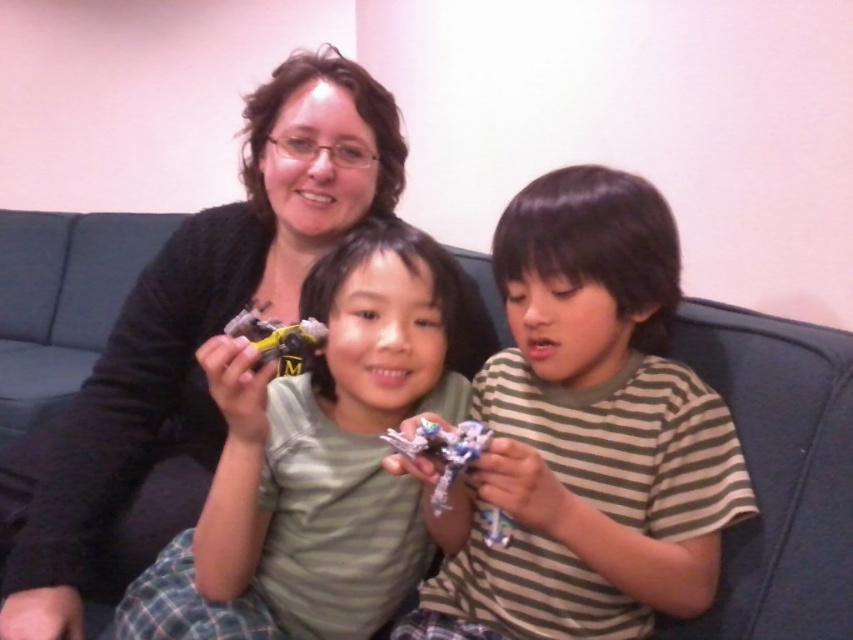
Which is more to the left, metallic silver toy at center or yellow plastic toy at center?

From the viewer's perspective, yellow plastic toy at center appears more on the left side.

Measure the distance between metallic silver toy at center and camera.

metallic silver toy at center is 26.01 inches away from camera.

Locate an element on the screen. This screenshot has width=853, height=640. metallic silver toy at center is located at coordinates tap(587, 433).

Looking at this image, is matte plastic toy car at center positioned in front of yellow plastic toy at center?

Yes, it is.

Is point (212, 490) closer to camera compared to point (263, 342)?

No, it is not.

Between point (431, 291) and point (254, 339), which one is positioned behind?

Point (431, 291)

Identify the location of matte plastic toy car at center. The height and width of the screenshot is (640, 853). (315, 460).

Can you confirm if metallic silver robot at center is bigger than yellow plastic toy at center?

No, metallic silver robot at center is not bigger than yellow plastic toy at center.

The image size is (853, 640). In order to click on metallic silver robot at center in this screenshot , I will do `click(442, 452)`.